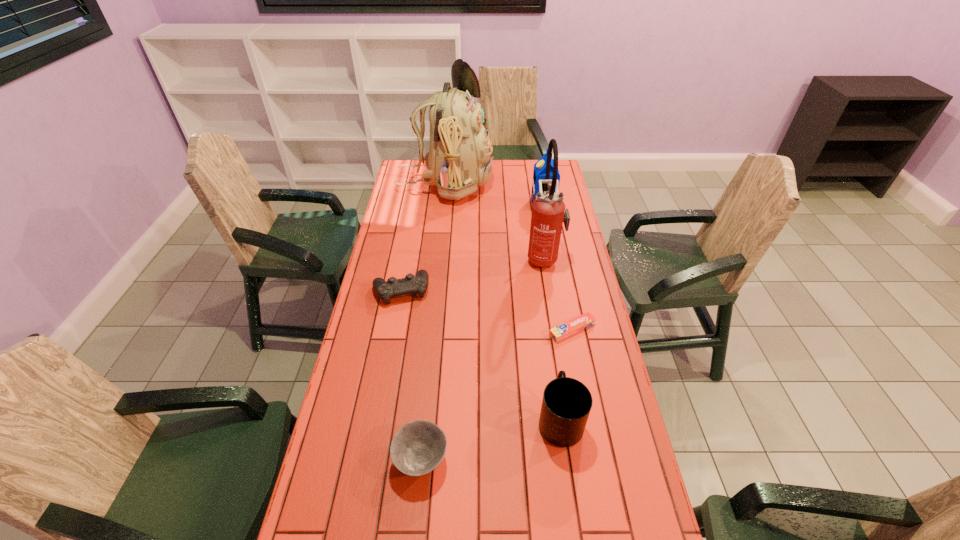
The image size is (960, 540). Identify the location of free space located at the nozzle of the fire extinguisher. (471, 258).

Locate an element on the screen. free space located at the nozzle of the fire extinguisher is located at coordinates (438, 258).

The width and height of the screenshot is (960, 540). I want to click on vacant area located with the cap open on the third tallest object, so click(510, 205).

Image resolution: width=960 pixels, height=540 pixels. In order to click on blank space located with the cap open on the third tallest object in this screenshot , I will do `click(491, 205)`.

Locate an element on the screen. free location located with the cap open on the third tallest object is located at coordinates (482, 205).

The height and width of the screenshot is (540, 960). Find the location of `vacant region located on the side of the mug with the handle`. vacant region located on the side of the mug with the handle is located at coordinates (548, 342).

Find the location of a particular element. The height and width of the screenshot is (540, 960). vacant space located on the side of the mug with the handle is located at coordinates (550, 352).

The height and width of the screenshot is (540, 960). What are the coordinates of `vacant space located on the side of the mug with the handle` in the screenshot? It's located at (546, 328).

Locate an element on the screen. vacant point located on the front of the control is located at coordinates coord(391,346).

You are a GUI agent. You are given a task and a screenshot of the screen. Output one action in this format:
    pyautogui.click(x=<x>, y=<y>)
    Task: Click on the vacant area located 0.060m on the left of the bowl
    
    Given the screenshot: What is the action you would take?
    pyautogui.click(x=371, y=460)